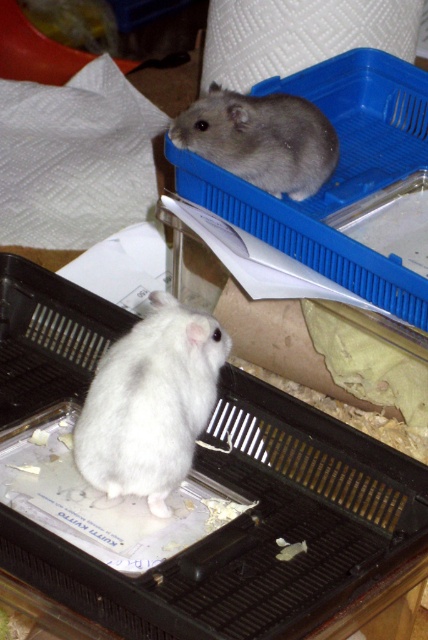
Is point (118, 422) less distant than point (199, 115)?

That is True.

In the scene shown: Can you confirm if white fluffy hamster at center is bigger than gray furry hamster at upper center?

Yes, white fluffy hamster at center is bigger than gray furry hamster at upper center.

Is point (204, 324) less distant than point (317, 141)?

Yes, point (204, 324) is in front of point (317, 141).

Image resolution: width=428 pixels, height=640 pixels. In order to click on white fluffy hamster at center in this screenshot , I will do `click(151, 403)`.